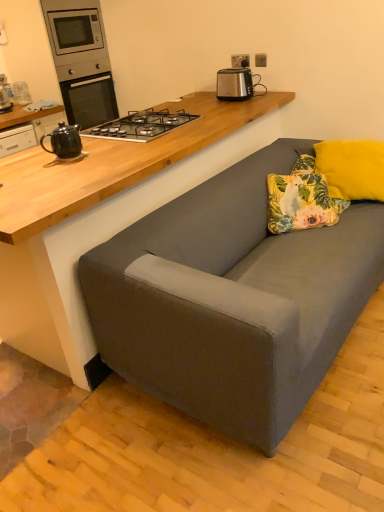
You are a GUI agent. You are given a task and a screenshot of the screen. Output one action in this format:
    pyautogui.click(x=<x>, y=<y>)
    Task: Click on the black metal/glass gas stove at upper center
    This screenshot has width=384, height=512.
    Given the screenshot: What is the action you would take?
    pyautogui.click(x=141, y=125)

What do you see at coordinates (141, 125) in the screenshot? The width and height of the screenshot is (384, 512). I see `black metal/glass gas stove at upper center` at bounding box center [141, 125].

You are a GUI agent. You are given a task and a screenshot of the screen. Output one action in this format:
    pyautogui.click(x=<x>, y=<y>)
    Task: Click on the black ceramic teapot at left
    Image resolution: width=384 pixels, height=512 pixels.
    Given the screenshot: What is the action you would take?
    pyautogui.click(x=64, y=141)

In order to face satin silver toaster at upper center, should I rotate leftwards or rightwards?

You should look right and rotate roughly 6.061 degrees.

Locate an element on the screen. The height and width of the screenshot is (512, 384). floral fabric pillow at center, acting as the 2th pillow starting from the right is located at coordinates (301, 202).

Which object is further away from the camera taking this photo, satin silver toaster at upper center or floral fabric pillow at center, acting as the 2th pillow starting from the right?

satin silver toaster at upper center is behind.

From a real-world perspective, relative to floral fabric pillow at center, which is the 1th pillow from left to right, is satin silver toaster at upper center vertically above or below?

satin silver toaster at upper center is above floral fabric pillow at center, which is the 1th pillow from left to right.

Considering the relative positions of satin silver toaster at upper center and floral fabric pillow at center, which is the 1th pillow from left to right, in the image provided, is satin silver toaster at upper center to the right of floral fabric pillow at center, which is the 1th pillow from left to right, from the viewer's perspective?

Incorrect, satin silver toaster at upper center is not on the right side of floral fabric pillow at center, which is the 1th pillow from left to right.

Is satin silver toaster at upper center positioned beyond the bounds of floral fabric pillow at center, acting as the 2th pillow starting from the right?

satin silver toaster at upper center lies outside floral fabric pillow at center, acting as the 2th pillow starting from the right,'s area.

Considering their positions, is brushed metal microwave at upper left located in front of or behind black ceramic teapot at left?

In the image, brushed metal microwave at upper left appears behind black ceramic teapot at left.

How different are the orientations of brushed metal microwave at upper left and black ceramic teapot at left in degrees?

180 degrees.

Based on the photo, is brushed metal microwave at upper left not close to black ceramic teapot at left?

brushed metal microwave at upper left is positioned a significant distance from black ceramic teapot at left.

Considering the relative positions of brushed metal microwave at upper left and black ceramic teapot at left in the image provided, is brushed metal microwave at upper left to the left or to the right of black ceramic teapot at left?

Based on their positions, brushed metal microwave at upper left is located to the left of black ceramic teapot at left.

From the image's perspective, is floral fabric pillow at center, acting as the 2th pillow starting from the right, below brushed metal microwave at upper left?

Indeed, from the image's perspective, floral fabric pillow at center, acting as the 2th pillow starting from the right, is shown beneath brushed metal microwave at upper left.

Based on the photo, from a real-world perspective, between floral fabric pillow at center, which is the 1th pillow from left to right, and brushed metal microwave at upper left, who is vertically lower?

From a 3D spatial view, floral fabric pillow at center, which is the 1th pillow from left to right, is below.

Does floral fabric pillow at center, which is the 1th pillow from left to right, come in front of brushed metal microwave at upper left?

Yes, floral fabric pillow at center, which is the 1th pillow from left to right, is in front of brushed metal microwave at upper left.

Who is bigger, floral fabric pillow at center, acting as the 2th pillow starting from the right, or brushed metal microwave at upper left?

brushed metal microwave at upper left is bigger.

Does brushed metal microwave at upper left turn towards floral fabric pillow at center, which is the 1th pillow from left to right?

Yes, brushed metal microwave at upper left is facing floral fabric pillow at center, which is the 1th pillow from left to right.

Are brushed metal microwave at upper left and floral fabric pillow at center, acting as the 2th pillow starting from the right, making contact?

No, brushed metal microwave at upper left is not in contact with floral fabric pillow at center, acting as the 2th pillow starting from the right.

Which object is closer to the camera taking this photo, brushed metal microwave at upper left or floral fabric pillow at center, acting as the 2th pillow starting from the right?

floral fabric pillow at center, acting as the 2th pillow starting from the right, is closer to the camera.

Find the location of a particular element. The width and height of the screenshot is (384, 512). home appliance located above the floral fabric pillow at center, acting as the 2th pillow starting from the right (from a real-world perspective) is located at coordinates (81, 60).

Between point (59, 138) and point (281, 228), which one is positioned in front?

The point (59, 138) is closer.

Is black ceramic teapot at left oriented towards floral fabric pillow at center, acting as the 2th pillow starting from the right?

No, black ceramic teapot at left does not turn towards floral fabric pillow at center, acting as the 2th pillow starting from the right.

Which is nearer, (346, 197) or (159, 112)?

Point (346, 197) is closer to the camera than point (159, 112).

Can you confirm if yellow fluffy pillow at upper right, acting as the first pillow starting from the right, is thinner than black metal/glass gas stove at upper center?

Yes.

Can you tell me how much yellow fluffy pillow at upper right, arranged as the second pillow when viewed from the left, and black metal/glass gas stove at upper center differ in facing direction?

111 degrees.

Who is smaller, yellow fluffy pillow at upper right, arranged as the second pillow when viewed from the left, or black metal/glass gas stove at upper center?

Smaller between the two is black metal/glass gas stove at upper center.

Can you confirm if satin silver toaster at upper center is bigger than black ceramic teapot at left?

Indeed, satin silver toaster at upper center has a larger size compared to black ceramic teapot at left.

Identify the location of kitchen appliance located below the satin silver toaster at upper center (from the image's perspective). (64, 141).

Is black ceramic teapot at left a part of satin silver toaster at upper center?

No, black ceramic teapot at left is not surrounded by satin silver toaster at upper center.

Locate an element on the screen. This screenshot has width=384, height=512. appliance that appears above the floral fabric pillow at center, which is the 1th pillow from left to right (from the image's perspective) is located at coordinates (237, 83).

Find the location of a particular element. kitchen appliance directly beneath the brushed metal microwave at upper left (from a real-world perspective) is located at coordinates (64, 141).

When comparing their distances from satin silver toaster at upper center, does yellow fluffy pillow at upper right, arranged as the second pillow when viewed from the left, or black metal/glass gas stove at upper center seem closer?

black metal/glass gas stove at upper center is positioned closer to the anchor satin silver toaster at upper center.

Based on their spatial positions, is brushed metal microwave at upper left or floral fabric pillow at center, which is the 1th pillow from left to right, closer to black metal/glass gas stove at upper center?

floral fabric pillow at center, which is the 1th pillow from left to right.

From the image, which object appears to be farther from satin silver toaster at upper center, brushed metal microwave at upper left or yellow fluffy pillow at upper right, arranged as the second pillow when viewed from the left?

The object further to satin silver toaster at upper center is brushed metal microwave at upper left.

Based on their spatial positions, is black metal/glass gas stove at upper center or yellow fluffy pillow at upper right, arranged as the second pillow when viewed from the left, closer to satin silver toaster at upper center?

black metal/glass gas stove at upper center lies closer to satin silver toaster at upper center than the other object.

Estimate the real-world distances between objects in this image. Which object is closer to black ceramic teapot at left, floral fabric pillow at center, acting as the 2th pillow starting from the right, or yellow fluffy pillow at upper right, arranged as the second pillow when viewed from the left?

floral fabric pillow at center, acting as the 2th pillow starting from the right, lies closer to black ceramic teapot at left than the other object.

Which object lies nearer to the anchor point yellow fluffy pillow at upper right, acting as the first pillow starting from the right, satin silver toaster at upper center or black metal/glass gas stove at upper center?

satin silver toaster at upper center.

Estimate the real-world distances between objects in this image. Which object is closer to floral fabric pillow at center, which is the 1th pillow from left to right, black metal/glass gas stove at upper center or black ceramic teapot at left?

The object closer to floral fabric pillow at center, which is the 1th pillow from left to right, is black metal/glass gas stove at upper center.

Considering their positions, is black ceramic teapot at left positioned closer to floral fabric pillow at center, acting as the 2th pillow starting from the right, than satin silver toaster at upper center?

satin silver toaster at upper center is positioned closer to the anchor floral fabric pillow at center, acting as the 2th pillow starting from the right.

Image resolution: width=384 pixels, height=512 pixels. In order to click on pillow located between black metal/glass gas stove at upper center and yellow fluffy pillow at upper right, arranged as the second pillow when viewed from the left, in the left-right direction in this screenshot , I will do `click(301, 202)`.

I want to click on appliance between brushed metal microwave at upper left and yellow fluffy pillow at upper right, acting as the first pillow starting from the right, in the horizontal direction, so click(237, 83).

Image resolution: width=384 pixels, height=512 pixels. I want to click on gas stove between black ceramic teapot at left and brushed metal microwave at upper left from front to back, so click(141, 125).

This screenshot has height=512, width=384. Find the location of `pillow between satin silver toaster at upper center and floral fabric pillow at center, which is the 1th pillow from left to right, vertically`. pillow between satin silver toaster at upper center and floral fabric pillow at center, which is the 1th pillow from left to right, vertically is located at coordinates (352, 168).